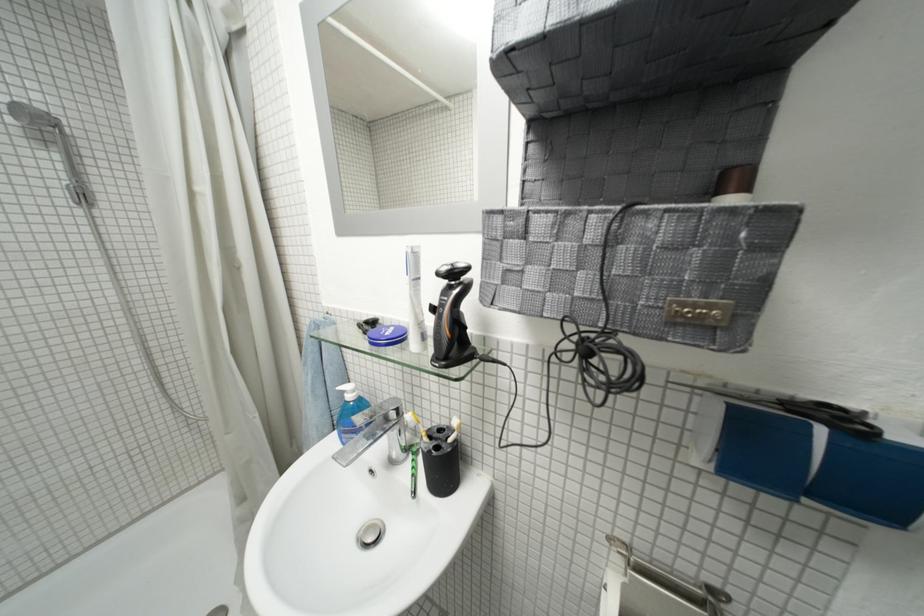
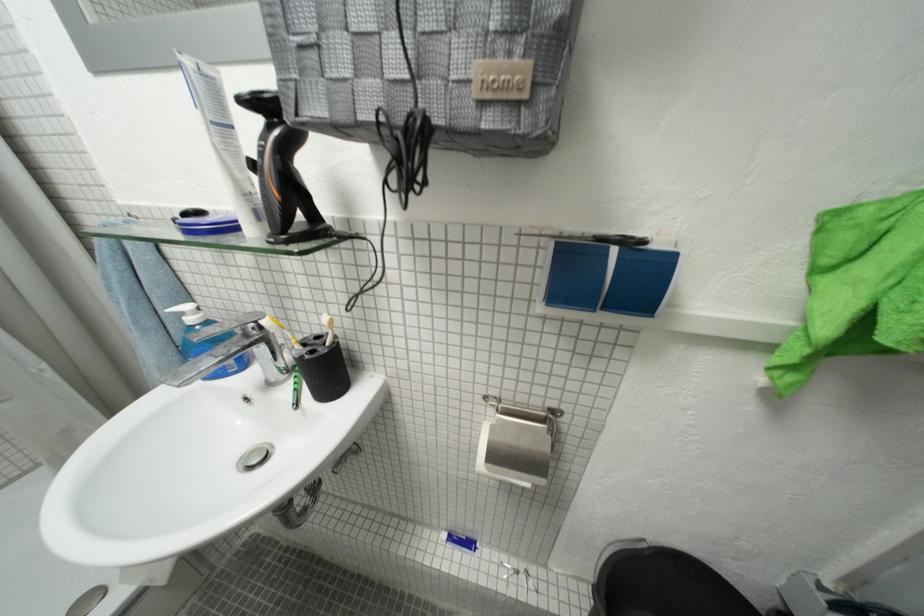
Where in the second image is the point corresponding to the point at 428,326 from the first image?

(252, 197)